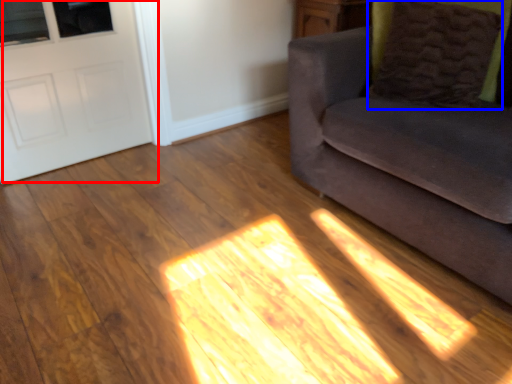
Question: Which object is closer to the camera taking this photo, door (highlighted by a red box) or pillow (highlighted by a blue box)?

Choices:
 (A) door
 (B) pillow

Answer: (B)